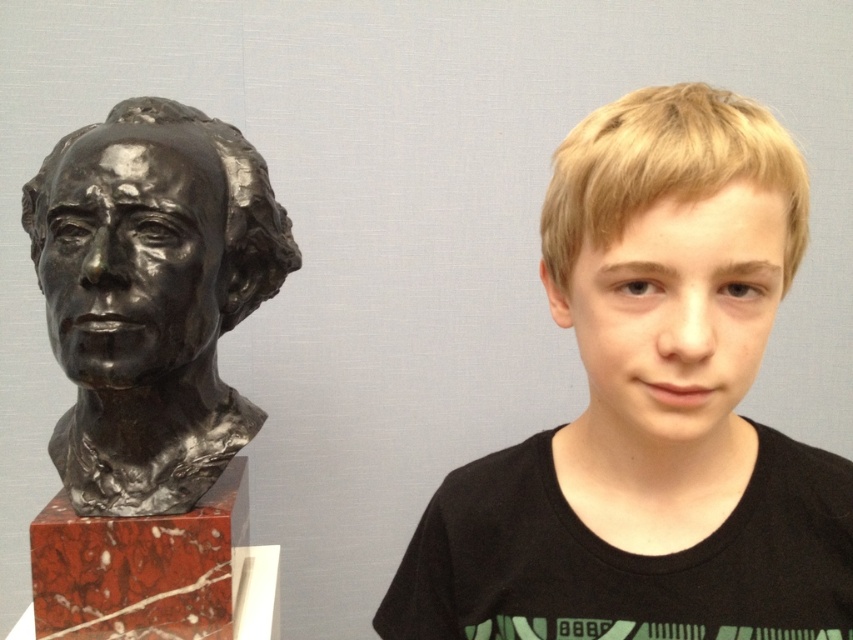
Between blonde hair boy at center and bronze sculpture at left, which one is positioned lower?

blonde hair boy at center is below.

Is blonde hair boy at center closer to camera compared to bronze sculpture at left?

Yes, blonde hair boy at center is in front of bronze sculpture at left.

Which is behind, point (691, 236) or point (254, 300)?

Positioned behind is point (254, 300).

This screenshot has height=640, width=853. In order to click on blonde hair boy at center in this screenshot , I will do `click(650, 410)`.